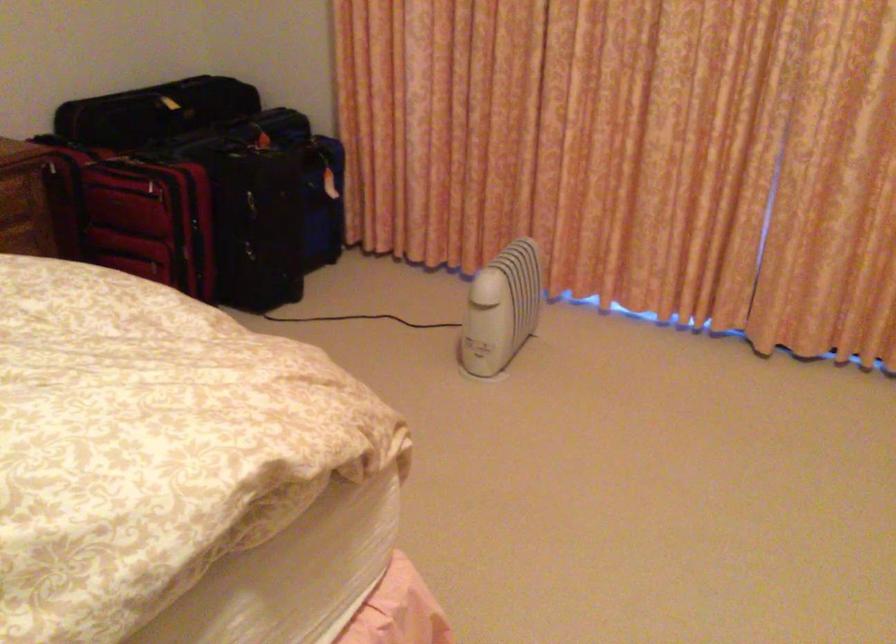
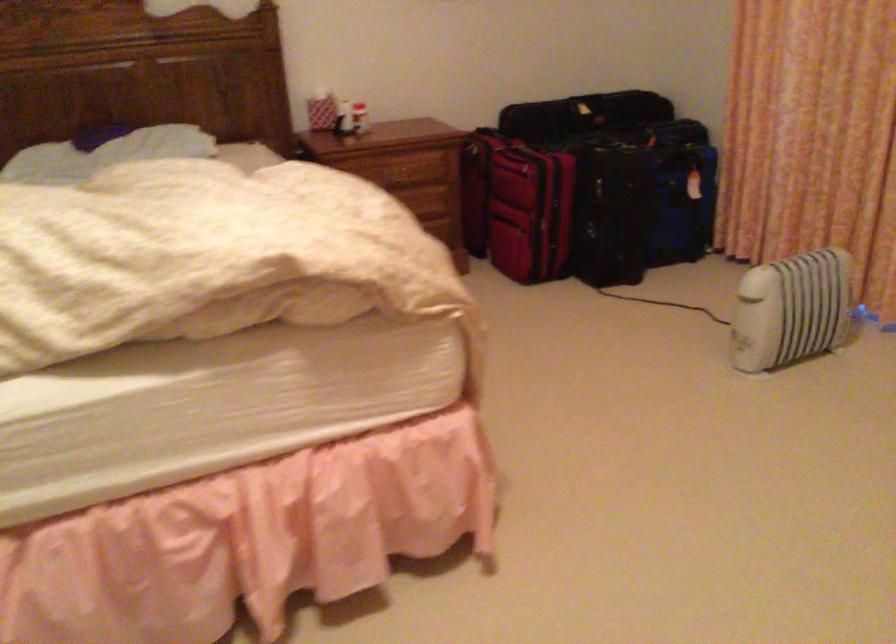
Question: Based on the continuous images, in which direction is the camera rotating? Reply with the corresponding letter.

Choices:
 (A) Left
 (B) Right
 (C) Up
 (D) Down

Answer: (A)